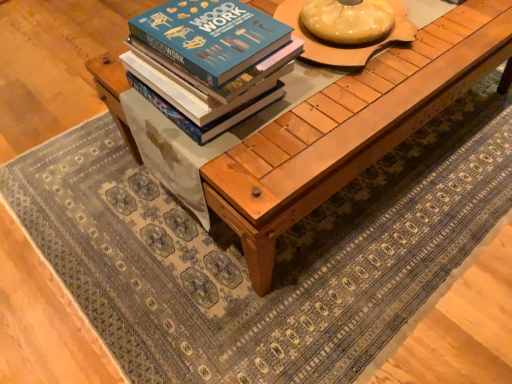
Locate an element on the screen. empty space that is to the right of blue matte book at center is located at coordinates (332, 107).